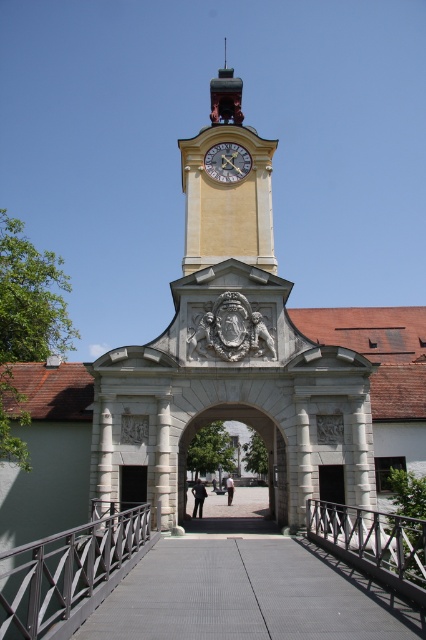
Based on the photo, you are standing at the entrance of the grand structure and want to walk towards the gold metallic clock at center. Which direction should you look to see the smooth concrete path at center?

The smooth concrete path at center is positioned under the gold metallic clock at center, so you should look downward to see the smooth concrete path at center while facing the gold metallic clock at center.

You are an architect analyzing the structure of the image. You need to determine which object has a larger size between the yellow painted clock tower at upper center and the white stone archway at center. Based on the scene description, which one is bigger?

A: The yellow painted clock tower at upper center is bigger than the white stone archway at center according to the description.